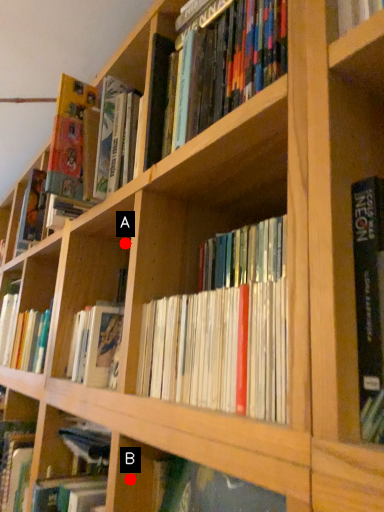
Question: Two points are circled on the image, labeled by A and B beside each circle. Which point is closer to the camera?

Choices:
 (A) A is closer
 (B) B is closer

Answer: (B)